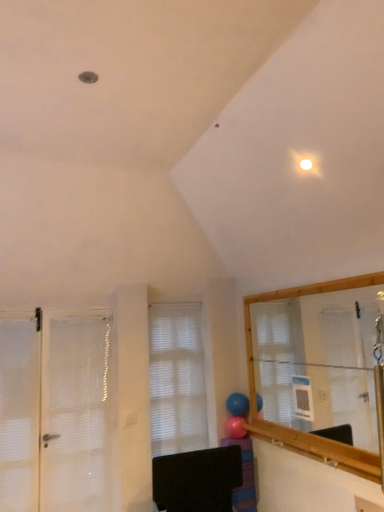
Question: In which direction should I rotate to look at rubber blue balloon at center, which is the 1th balloon from top to bottom?

Choices:
 (A) left
 (B) right

Answer: (B)

Question: From the image's perspective, would you say white mesh door at left is positioned over rubber blue balloon at center, which is the second balloon in bottom-to-top order?

Choices:
 (A) no
 (B) yes

Answer: (B)

Question: Can you confirm if white mesh door at left is thinner than rubber blue balloon at center, which is the 1th balloon from top to bottom?

Choices:
 (A) no
 (B) yes

Answer: (B)

Question: Considering the relative positions of white mesh door at left and rubber blue balloon at center, which is the second balloon in bottom-to-top order, in the image provided, is white mesh door at left behind rubber blue balloon at center, which is the second balloon in bottom-to-top order,?

Choices:
 (A) no
 (B) yes

Answer: (A)

Question: Does white mesh door at left appear on the left side of rubber blue balloon at center, which is the 1th balloon from top to bottom?

Choices:
 (A) no
 (B) yes

Answer: (B)

Question: Is white mesh door at left wider than rubber blue balloon at center, which is the 1th balloon from top to bottom?

Choices:
 (A) yes
 (B) no

Answer: (B)

Question: From a real-world perspective, is white mesh door at left on top of rubber blue balloon at center, which is the 1th balloon from top to bottom?

Choices:
 (A) no
 (B) yes

Answer: (B)

Question: From the image's perspective, would you say pink rubber balloon at center, which ranks as the 2th balloon in top-to-bottom order, is shown under white mesh door at left?

Choices:
 (A) yes
 (B) no

Answer: (A)

Question: Can you confirm if pink rubber balloon at center, which ranks as the 2th balloon in top-to-bottom order, is bigger than white mesh door at left?

Choices:
 (A) yes
 (B) no

Answer: (B)

Question: Could you tell me if pink rubber balloon at center, which is counted as the first balloon, starting from the bottom, is turned towards white mesh door at left?

Choices:
 (A) no
 (B) yes

Answer: (B)

Question: Considering the relative sizes of pink rubber balloon at center, which ranks as the 2th balloon in top-to-bottom order, and white mesh door at left in the image provided, is pink rubber balloon at center, which ranks as the 2th balloon in top-to-bottom order, wider than white mesh door at left?

Choices:
 (A) yes
 (B) no

Answer: (A)

Question: Is pink rubber balloon at center, which is counted as the first balloon, starting from the bottom, completely or partially outside of white mesh door at left?

Choices:
 (A) no
 (B) yes

Answer: (B)

Question: Is pink rubber balloon at center, which is counted as the first balloon, starting from the bottom, touching white mesh door at left?

Choices:
 (A) yes
 (B) no

Answer: (B)

Question: Is white matte window at center outside of pink rubber balloon at center, which is counted as the first balloon, starting from the bottom?

Choices:
 (A) yes
 (B) no

Answer: (A)